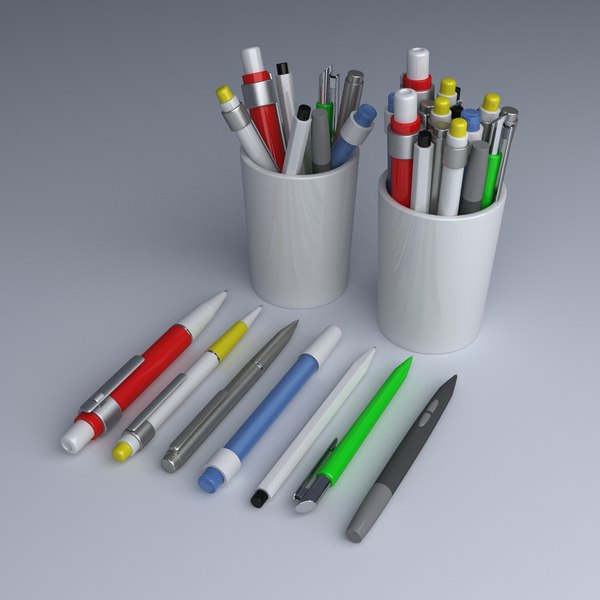
You are a GUI agent. You are given a task and a screenshot of the screen. Output one action in this format:
    pyautogui.click(x=<x>, y=<y>)
    Task: Click on the pens clips
    
    Given the screenshot: What is the action you would take?
    pyautogui.click(x=116, y=385), pyautogui.click(x=141, y=411), pyautogui.click(x=200, y=423), pyautogui.click(x=314, y=469), pyautogui.click(x=331, y=91), pyautogui.click(x=492, y=145), pyautogui.click(x=425, y=123)